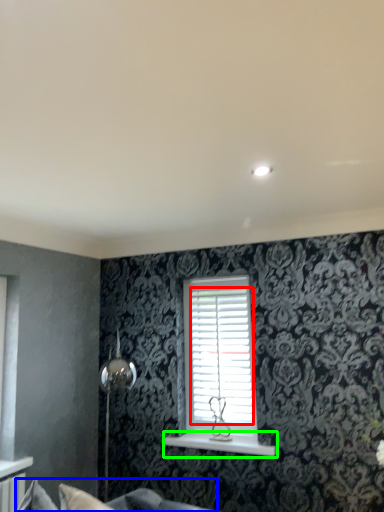
Question: Which is nearer to the shutter (highlighted by a red box)? couch (highlighted by a blue box) or window sill (highlighted by a green box).

Choices:
 (A) couch
 (B) window sill

Answer: (B)